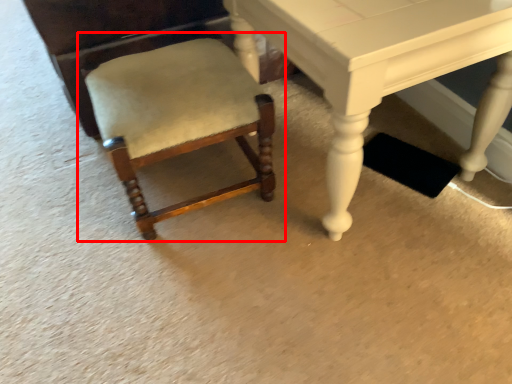
Question: From the image's perspective, what is the correct spatial relationship of chair (annotated by the red box) in relation to table?

Choices:
 (A) above
 (B) below

Answer: (B)